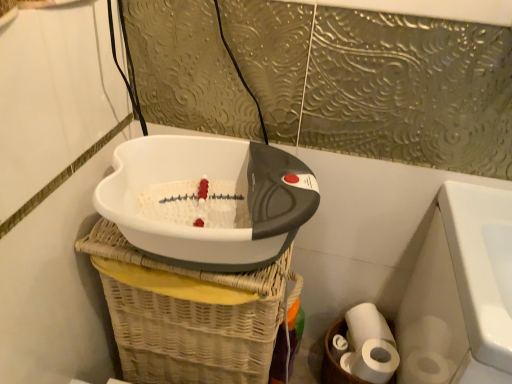
You are a GUI agent. You are given a task and a screenshot of the screen. Output one action in this format:
    pyautogui.click(x=<x>, y=<y>)
    Task: Click on the blank space situated above white matte toilet paper at lower right (from a real-world perspective)
    
    Given the screenshot: What is the action you would take?
    pyautogui.click(x=373, y=328)